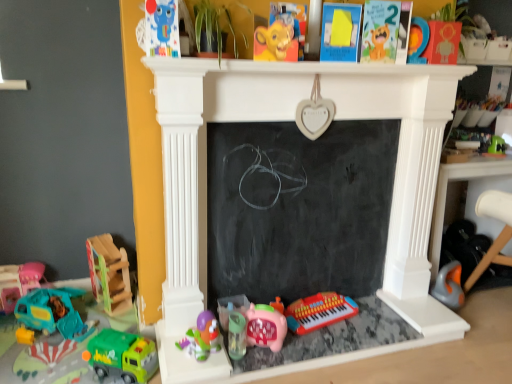
Locate an element on the screen. The width and height of the screenshot is (512, 384). vacant space in between orange plastic vacuum cleaner at lower right, the 1th toy viewed from the right, and wooden chair at right is located at coordinates (480, 318).